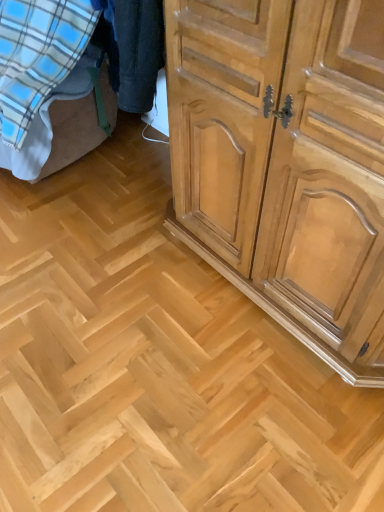
Question: Based on their sizes in the image, would you say light brown wood cabinet at right is bigger or smaller than blue plaid fabric at lower left?

Choices:
 (A) big
 (B) small

Answer: (B)

Question: Which is correct: light brown wood cabinet at right is inside blue plaid fabric at lower left, or outside of it?

Choices:
 (A) inside
 (B) outside

Answer: (B)

Question: Is point (240, 272) closer or farther from the camera than point (34, 174)?

Choices:
 (A) farther
 (B) closer

Answer: (B)

Question: Is blue plaid fabric at lower left inside the boundaries of light brown wood cabinet at right, or outside?

Choices:
 (A) outside
 (B) inside

Answer: (A)

Question: Looking at their shapes, would you say blue plaid fabric at lower left is wider or thinner than light brown wood cabinet at right?

Choices:
 (A) wide
 (B) thin

Answer: (A)

Question: Considering the positions of blue plaid fabric at lower left and light brown wood cabinet at right in the image, is blue plaid fabric at lower left taller or shorter than light brown wood cabinet at right?

Choices:
 (A) short
 (B) tall

Answer: (A)

Question: Looking at the image, does blue plaid fabric at lower left seem bigger or smaller compared to light brown wood cabinet at right?

Choices:
 (A) small
 (B) big

Answer: (B)